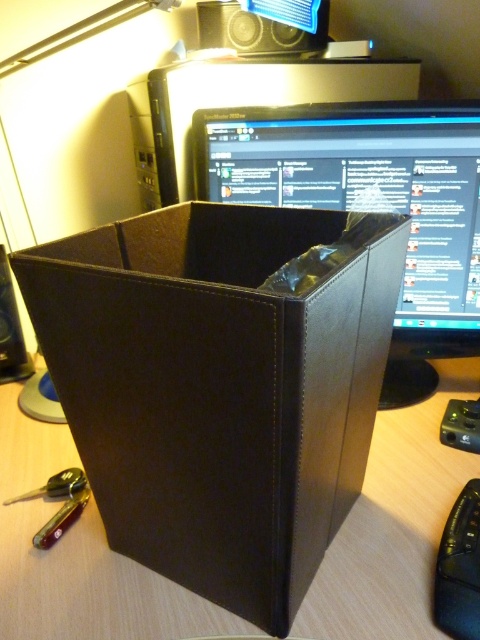
Between black plastic mouse at lower right and black leather speaker at left, which one is positioned lower?

black plastic mouse at lower right is below.

Does black plastic mouse at lower right appear under black leather speaker at left?

Correct, black plastic mouse at lower right is located below black leather speaker at left.

Does point (460, 605) lie behind point (4, 317)?

No, it is not.

At what (x,y) coordinates should I click in order to perform the action: click on black plastic mouse at lower right. Please return your answer as a coordinate pair (x, y). The height and width of the screenshot is (640, 480). Looking at the image, I should click on (459, 566).

Is black plastic mouse at lower right to the left of black plastic speaker at upper center from the viewer's perspective?

In fact, black plastic mouse at lower right is to the right of black plastic speaker at upper center.

Which of these two, black plastic mouse at lower right or black plastic speaker at upper center, stands taller?

Standing taller between the two is black plastic speaker at upper center.

Is point (460, 632) positioned in front of point (317, 29)?

Yes, point (460, 632) is closer to viewer.

The width and height of the screenshot is (480, 640). Identify the location of black plastic mouse at lower right. (459, 566).

Is black leather box at center positioned in front of black plastic speaker at upper center?

Yes.

Where is `black leather box at center`? Image resolution: width=480 pixels, height=640 pixels. black leather box at center is located at coordinates (219, 387).

The image size is (480, 640). What are the coordinates of `black leather box at center` in the screenshot? It's located at (219, 387).